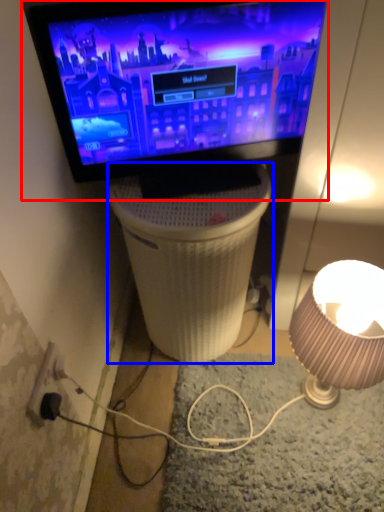
Question: Which object appears closest to the camera in this image, television (highlighted by a red box) or table (highlighted by a blue box)?

Choices:
 (A) television
 (B) table

Answer: (A)